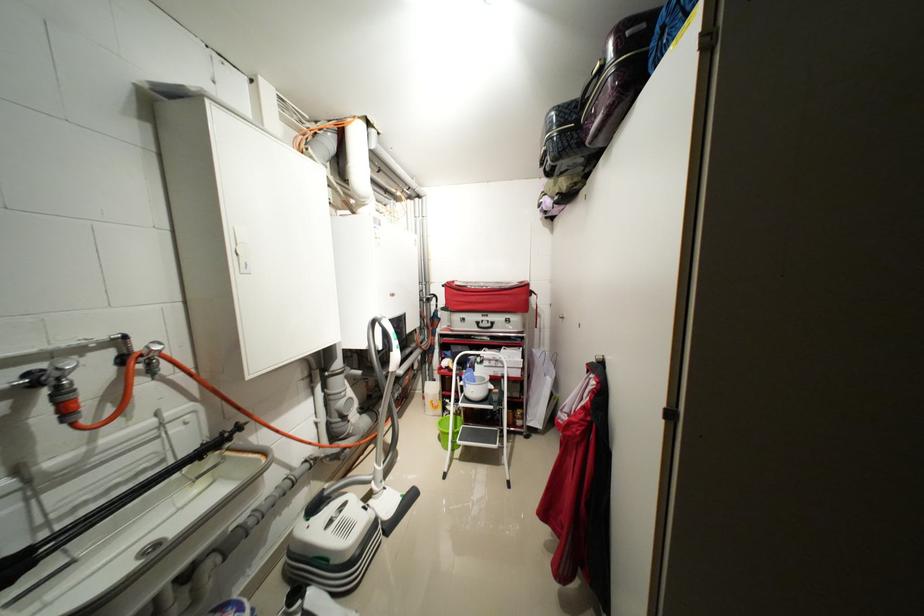
This screenshot has width=924, height=616. What are the coordinates of `black valve handle` in the screenshot? It's located at [65, 398].